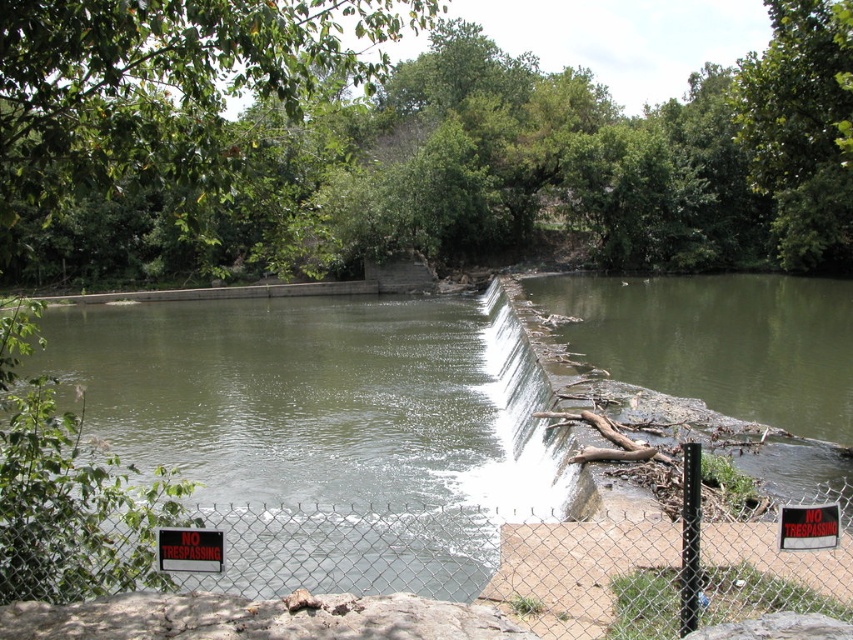
Which of these two, metal chain-link fence at lower center or chain-link fence at center, stands taller?

With more height is metal chain-link fence at lower center.

Does point (202, 621) come behind point (543, 566)?

No, it is not.

Between point (595, 637) and point (785, 600), which one is positioned in front?

Point (595, 637) is more forward.

Find the location of a particular element. The image size is (853, 640). metal chain-link fence at lower center is located at coordinates (427, 579).

Which of these two, green concrete dam at center or white concrete waterfall at center, stands taller?

With more height is white concrete waterfall at center.

Does green concrete dam at center have a lesser width compared to white concrete waterfall at center?

No.

Where is `green concrete dam at center`? Image resolution: width=853 pixels, height=640 pixels. green concrete dam at center is located at coordinates (325, 433).

I want to click on green concrete dam at center, so click(x=325, y=433).

Which is behind, point (343, 499) or point (821, 609)?

Positioned behind is point (343, 499).

Is green concrete dam at center to the left of chain-link fence at center from the viewer's perspective?

Indeed, green concrete dam at center is positioned on the left side of chain-link fence at center.

The width and height of the screenshot is (853, 640). Identify the location of green concrete dam at center. (325, 433).

At what (x,y) coordinates should I click in order to perform the action: click on green concrete dam at center. Please return your answer as a coordinate pair (x, y). This screenshot has width=853, height=640. Looking at the image, I should click on (325, 433).